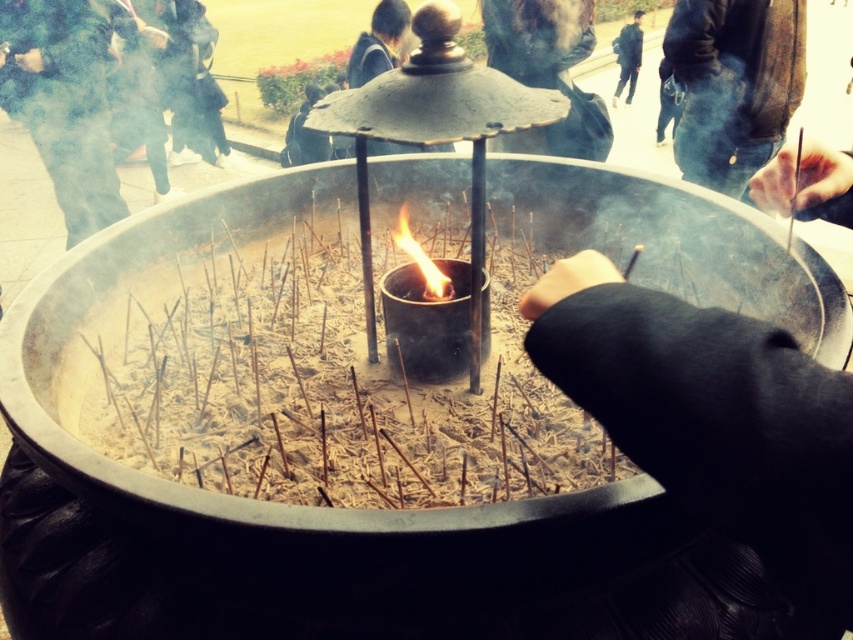
At what (x,y) coordinates should I click in order to perform the action: click on black matte hand at center. Please return your answer as a coordinate pair (x, y). This screenshot has width=853, height=640. Looking at the image, I should click on (711, 417).

This screenshot has height=640, width=853. Describe the element at coordinates (711, 417) in the screenshot. I see `black matte hand at center` at that location.

Does point (762, 499) come in front of point (402, 220)?

Yes.

Identify the location of black matte hand at center. (711, 417).

Is green fabric at left further to camera compared to flameliquidfire at center?

Yes, green fabric at left is behind flameliquidfire at center.

From the picture: Who is taller, green fabric at left or flameliquidfire at center?

Standing taller between the two is green fabric at left.

Between point (24, 19) and point (444, 284), which one is positioned in front?

Point (444, 284) is in front.

The image size is (853, 640). Find the location of `green fabric at left`. green fabric at left is located at coordinates (62, 102).

Is point (509, 72) farther from camera compared to point (409, 241)?

Yes, point (509, 72) is behind point (409, 241).

From the picture: Who is more distant from viewer, (553, 12) or (431, 269)?

The point (553, 12) is more distant.

The image size is (853, 640). Describe the element at coordinates (548, 70) in the screenshot. I see `dark brown leather jacket at upper center` at that location.

Find the location of a particular element. dark brown leather jacket at upper center is located at coordinates (548, 70).